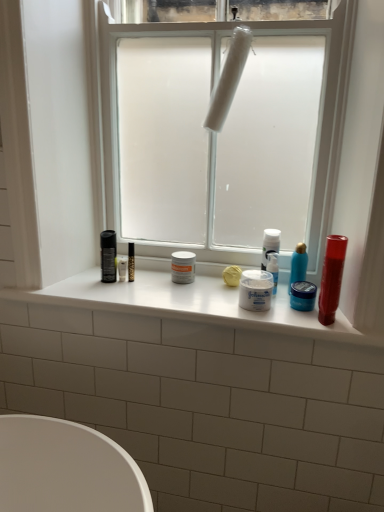
The height and width of the screenshot is (512, 384). I want to click on free point to the left of shiny red tube at right, so click(x=284, y=315).